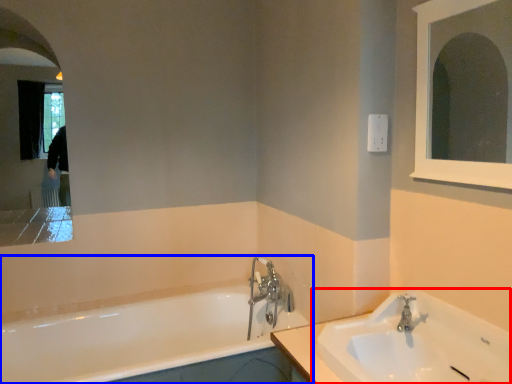
Question: Which point is closer to the camera, sink (highlighted by a red box) or bathtub (highlighted by a blue box)?

Choices:
 (A) sink
 (B) bathtub

Answer: (A)